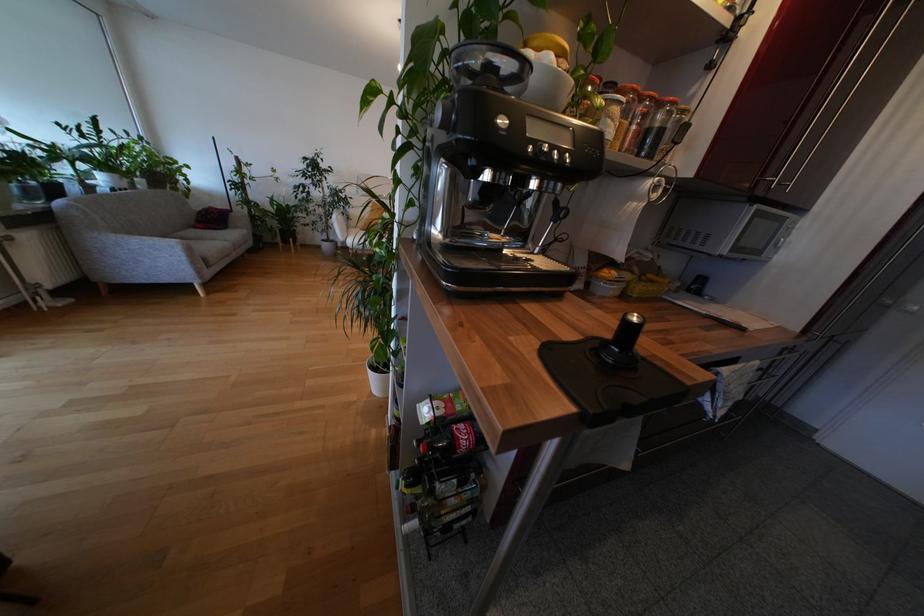
What are the coordinates of `coffee tamper handle` in the screenshot? It's located at (444, 113).